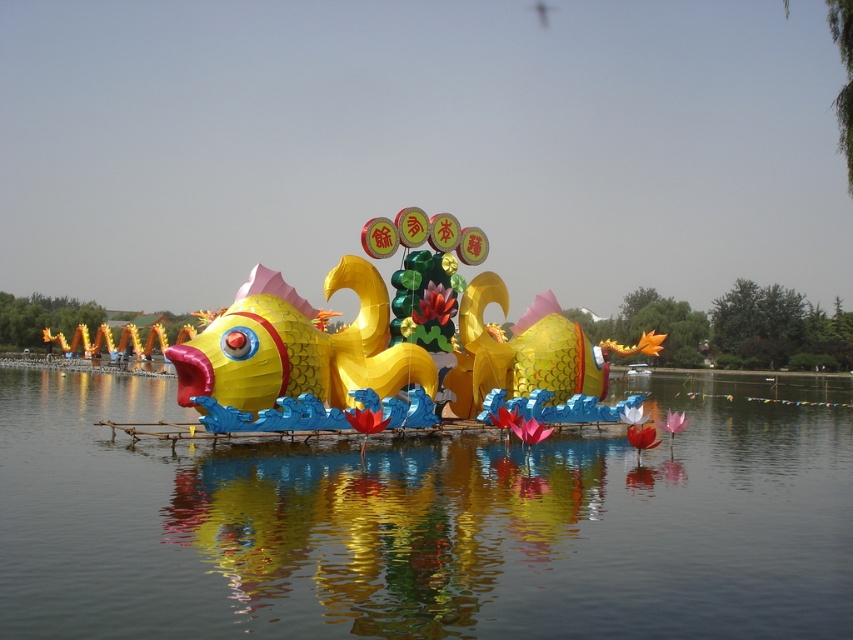
You are standing at the edge of the water and want to place a small boat exactly where the glossy water at center is located. What are the coordinates where you should place the boat?

The glossy water at center is located at coordinates point (421, 525), so you should place the boat there.